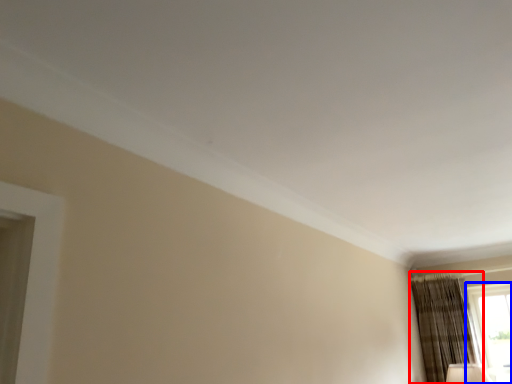
Question: Which object is closer to the camera taking this photo, curtain (highlighted by a red box) or window (highlighted by a blue box)?

Choices:
 (A) curtain
 (B) window

Answer: (A)